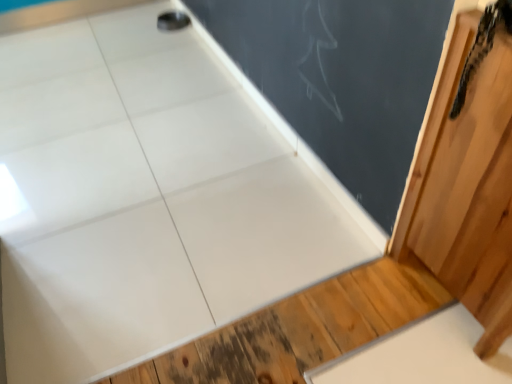
This screenshot has width=512, height=384. I want to click on vacant area on top of matte black chalkboard at upper center (from a real-world perspective), so click(269, 100).